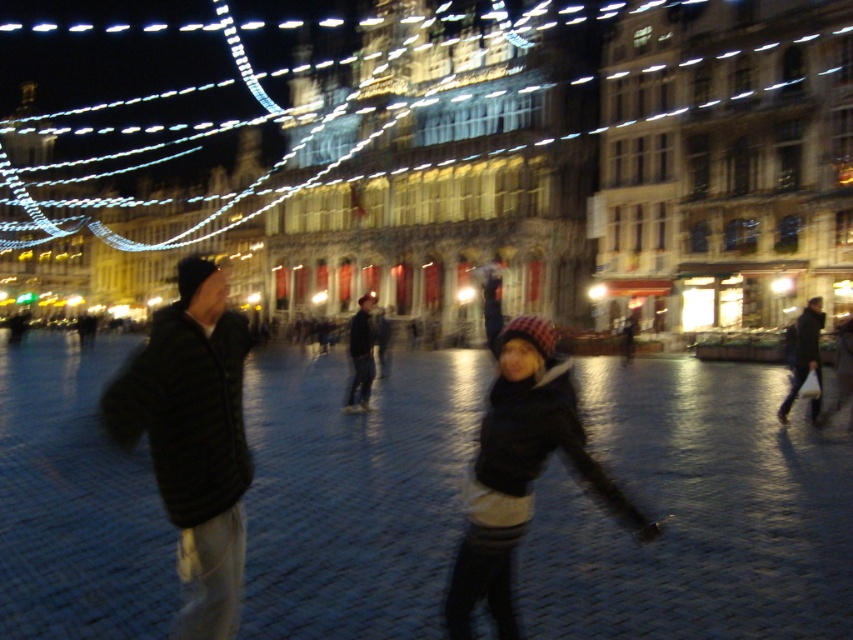
Question: Observing the image, what is the correct spatial positioning of black fuzzy jacket at left in reference to plaid woolen hat at center?

Choices:
 (A) below
 (B) above

Answer: (B)

Question: Does plaid woolen hat at center appear under dark gray jacket at right?

Choices:
 (A) no
 (B) yes

Answer: (B)

Question: Which object appears farthest from the camera in this image?

Choices:
 (A) plaid woolen hat at center
 (B) black fuzzy jacket at left
 (C) dark blue jeans at center
 (D) dark gray jacket at right

Answer: (C)

Question: Among these objects, which one is farthest from the camera?

Choices:
 (A) black fuzzy jacket at left
 (B) dark gray jacket at right
 (C) dark blue jeans at center

Answer: (C)

Question: Is dark gray jacket at right thinner than dark blue jeans at center?

Choices:
 (A) yes
 (B) no

Answer: (B)

Question: Which point is farther to the camera?

Choices:
 (A) dark blue jeans at center
 (B) black fuzzy jacket at left
 (C) plaid woolen hat at center
 (D) dark gray jacket at right

Answer: (A)